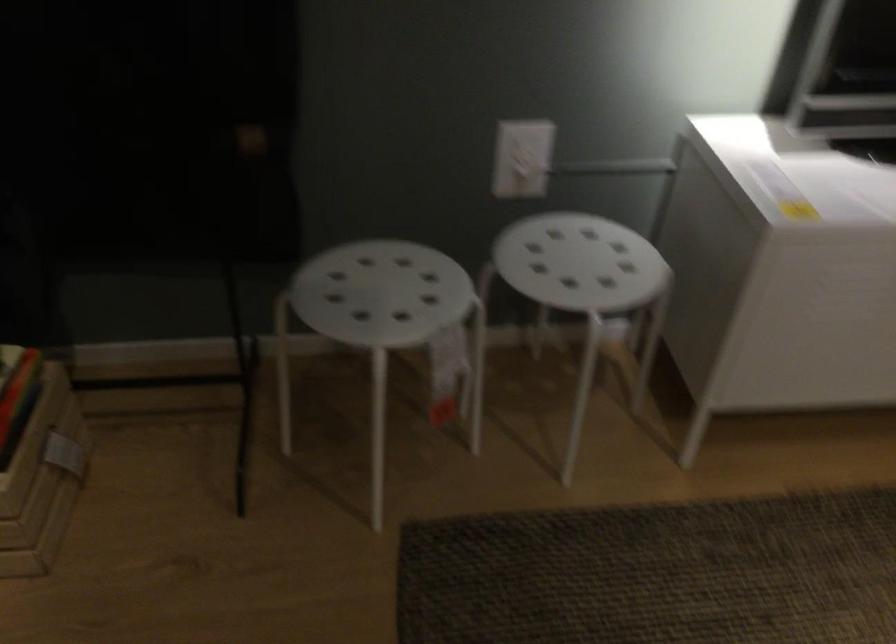
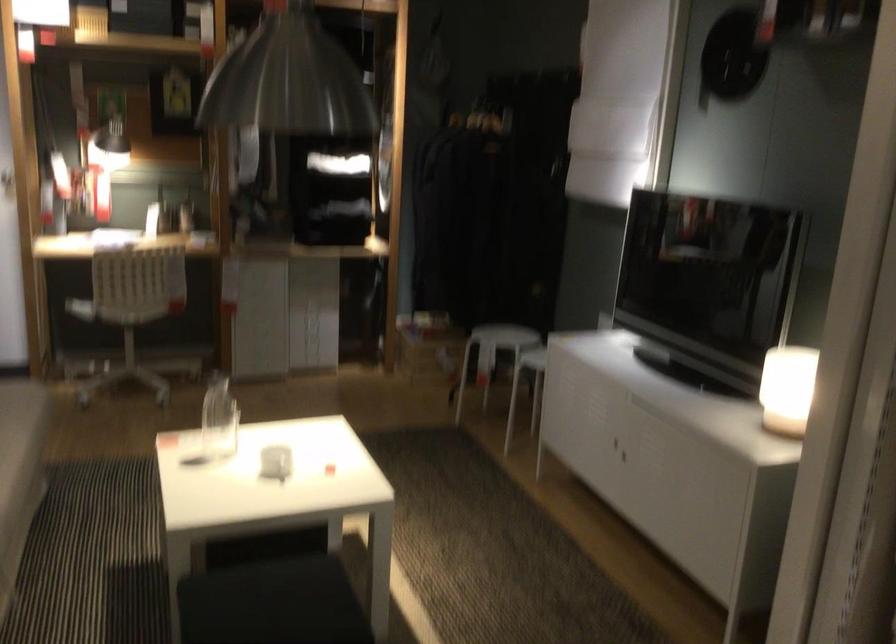
Find the pixel in the second image that matches point 450,361 in the first image.

(492, 355)